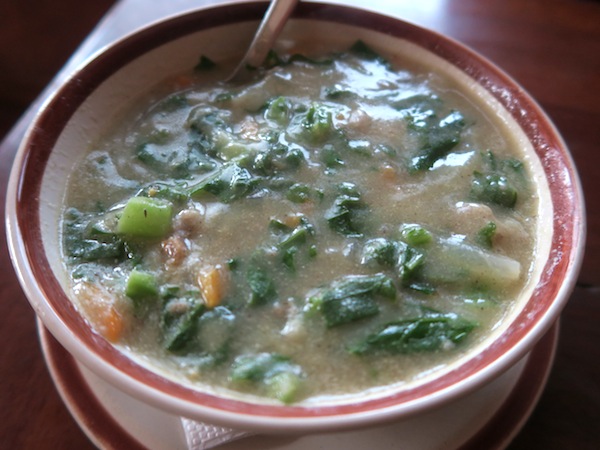
The width and height of the screenshot is (600, 450). I want to click on inner side of plate, so click(x=95, y=110).